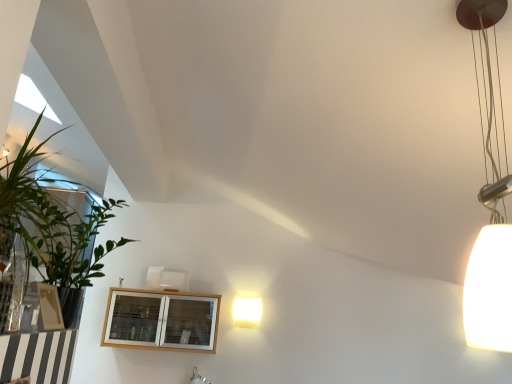
Question: In terms of height, does matte white lamp at center, which appears as the 2th lamp when viewed from the top, look taller or shorter compared to wooden cabinet at lower left?

Choices:
 (A) short
 (B) tall

Answer: (A)

Question: From the image's perspective, relative to wooden cabinet at lower left, is matte white lamp at center, the 1th lamp when ordered from bottom to top, above or below?

Choices:
 (A) above
 (B) below

Answer: (A)

Question: Which object is positioned farthest from the matte white lamp at center, which is the 2th lamp from front to back?

Choices:
 (A) green leafy plant at left
 (B) white matte lampshade at right, marked as the 2th lamp in a back-to-front arrangement
 (C) wooden cabinet at lower left

Answer: (B)

Question: Based on their relative distances, which object is farther from the matte white lamp at center, the 1th lamp when ordered from bottom to top?

Choices:
 (A) white matte lampshade at right, which is counted as the 2th lamp, starting from the left
 (B) wooden cabinet at lower left
 (C) green leafy plant at left

Answer: (A)